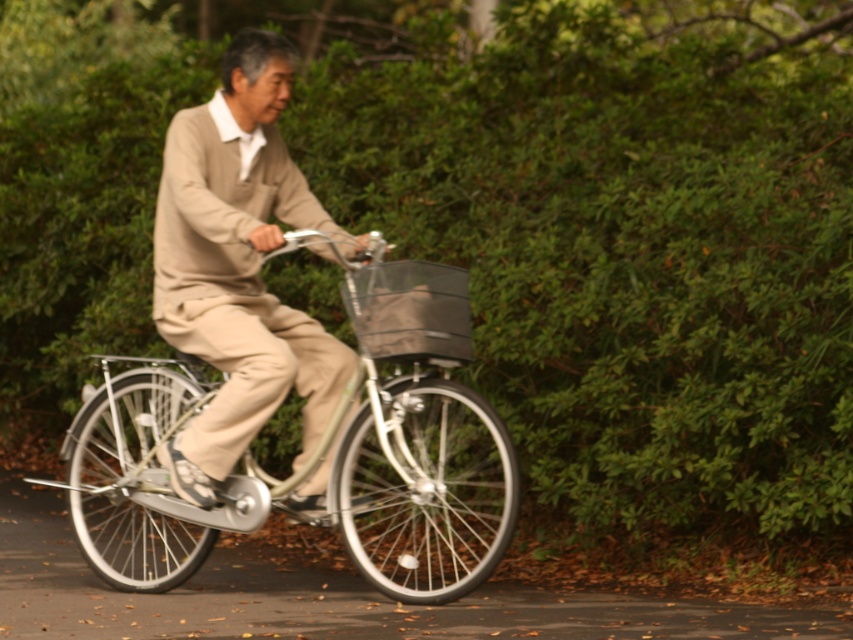
Question: Which of the following is the closest to the observer?

Choices:
 (A) click(x=262, y=285)
 (B) click(x=372, y=433)

Answer: (B)

Question: Considering the real-world distances, which object is closest to the matte gray fabric basket at center?

Choices:
 (A) beige wool sweater at center
 (B) silver metallic bicycle at center

Answer: (A)

Question: Is silver metallic bicycle at center to the right of beige wool sweater at center from the viewer's perspective?

Choices:
 (A) no
 (B) yes

Answer: (A)

Question: Which point is closer to the camera taking this photo?

Choices:
 (A) (282, 108)
 (B) (346, 285)
 (C) (413, 592)

Answer: (C)

Question: Does silver metallic bicycle at center appear over beige wool sweater at center?

Choices:
 (A) no
 (B) yes

Answer: (A)

Question: Where is silver metallic bicycle at center located in relation to matte gray fabric basket at center in the image?

Choices:
 (A) left
 (B) right

Answer: (A)